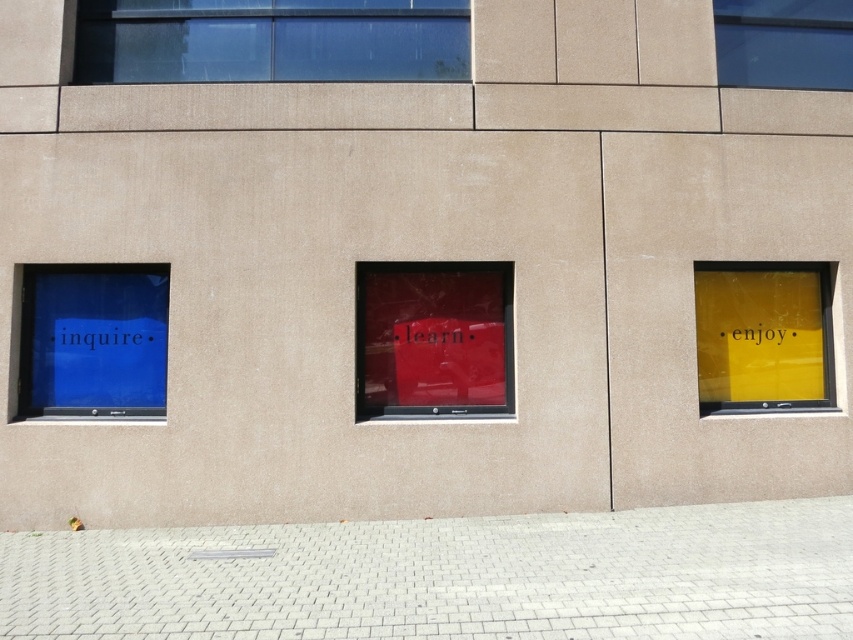
You are standing in front of the building and want to read the words on the transparent glass window at upper center and the transparent glass window at upper right. Which window has a larger surface area?

The transparent glass window at upper center is bigger than the transparent glass window at upper right, so the window at upper center has a larger surface area.

You are standing 7 meters away from a building with a modern design. The building has a transparent glass window at upper center. Can you safely approach the window to touch it without moving closer than 7 meters?

The transparent glass window at upper center is 7.83 meters away from you, so you can approach it to touch it while staying at 7 meters distance since it is slightly farther than your current position.

You are standing in front of a building with three windows. The left window has a blue background with the word inquire, the middle has a red background with learn, and the right has a yellow background with enjoy. You need to locate the transparent glass window at upper center. Which window should you look at?

The transparent glass window at upper center is located at the middle window with the red background and the word learn.